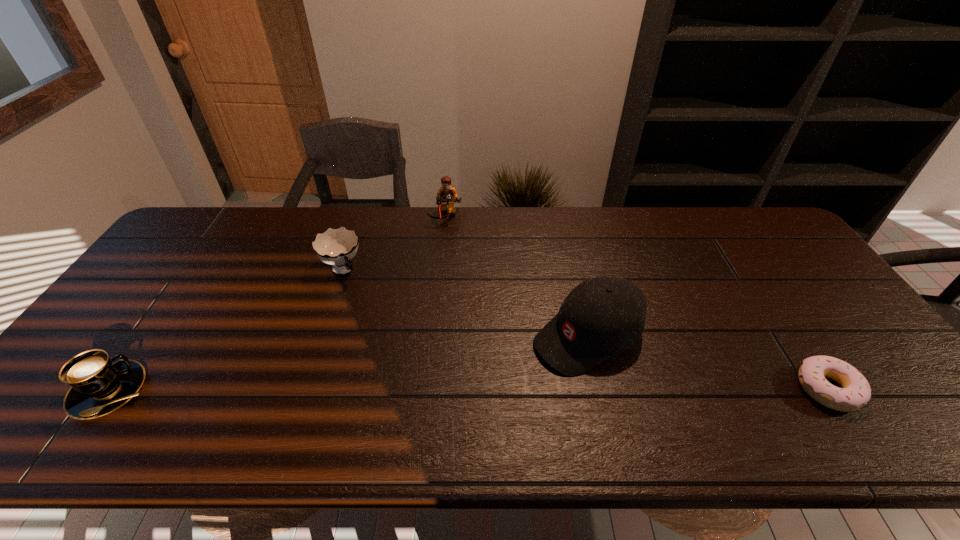
You are a GUI agent. You are given a task and a screenshot of the screen. Output one action in this format:
    pyautogui.click(x=<x>, y=<y>)
    Task: Click on the free area in between the leftmost object and the third object from right to left
    The height and width of the screenshot is (540, 960).
    Given the screenshot: What is the action you would take?
    pyautogui.click(x=277, y=303)

Locate an element on the screen. Image resolution: width=960 pixels, height=540 pixels. free area in between the cappuccino and the fourth nearest object is located at coordinates coord(227,330).

Select which object is the closest to the leftmost object. Please provide its 2D coordinates. Your answer should be formatted as a tuple, i.e. [(x, y)], where the tuple contains the x and y coordinates of a point satisfying the conditions above.

[(336, 247)]

At what (x,y) coordinates should I click in order to perform the action: click on object that is the third closest one to the Lego. Please return your answer as a coordinate pair (x, y). Image resolution: width=960 pixels, height=540 pixels. Looking at the image, I should click on (100, 385).

Find the location of `free space that satisfies the following two spatial constraints: 1. on the back side of the cappuccino; 2. on the left side of the second farthest object`. free space that satisfies the following two spatial constraints: 1. on the back side of the cappuccino; 2. on the left side of the second farthest object is located at coordinates (195, 270).

The height and width of the screenshot is (540, 960). Identify the location of blank space that satisfies the following two spatial constraints: 1. on the front side of the cup; 2. on the right side of the shortest object. (301, 389).